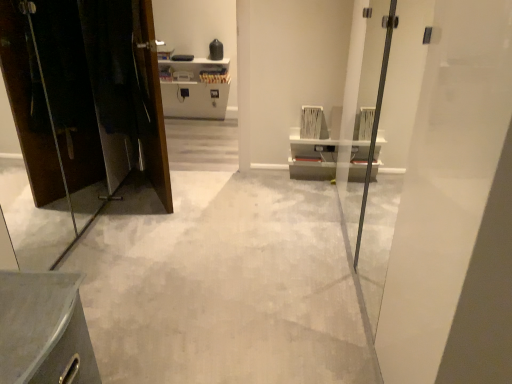
Question: Can you confirm if white glossy door at right is thinner than matte black elevator at left?

Choices:
 (A) yes
 (B) no

Answer: (B)

Question: From the image's perspective, is white glossy door at right located beneath matte black elevator at left?

Choices:
 (A) no
 (B) yes

Answer: (B)

Question: Is white glossy door at right facing towards matte black elevator at left?

Choices:
 (A) no
 (B) yes

Answer: (B)

Question: Is white glossy door at right bigger than matte black elevator at left?

Choices:
 (A) yes
 (B) no

Answer: (A)

Question: Does white glossy door at right have a smaller size compared to matte black elevator at left?

Choices:
 (A) no
 (B) yes

Answer: (A)

Question: From a real-world perspective, is metallic gray cabinet at lower left positioned above or below matte black elevator at left?

Choices:
 (A) below
 (B) above

Answer: (A)

Question: In terms of size, does metallic gray cabinet at lower left appear bigger or smaller than matte black elevator at left?

Choices:
 (A) big
 (B) small

Answer: (B)

Question: Considering the relative positions of metallic gray cabinet at lower left and matte black elevator at left in the image provided, is metallic gray cabinet at lower left to the left or to the right of matte black elevator at left?

Choices:
 (A) left
 (B) right

Answer: (B)

Question: From the image's perspective, is metallic gray cabinet at lower left located above or below matte black elevator at left?

Choices:
 (A) below
 (B) above

Answer: (A)

Question: In terms of size, does white glossy door at right appear bigger or smaller than gray concrete floor at center?

Choices:
 (A) small
 (B) big

Answer: (B)

Question: Relative to gray concrete floor at center, is white glossy door at right in front or behind?

Choices:
 (A) behind
 (B) front

Answer: (B)

Question: Do you think white glossy door at right is within gray concrete floor at center, or outside of it?

Choices:
 (A) inside
 (B) outside

Answer: (B)

Question: Looking at their shapes, would you say white glossy door at right is wider or thinner than gray concrete floor at center?

Choices:
 (A) thin
 (B) wide

Answer: (A)

Question: Does point (293, 292) appear closer or farther from the camera than point (440, 122)?

Choices:
 (A) farther
 (B) closer

Answer: (A)

Question: Would you say gray concrete floor at center is inside or outside white glossy door at right?

Choices:
 (A) inside
 (B) outside

Answer: (B)